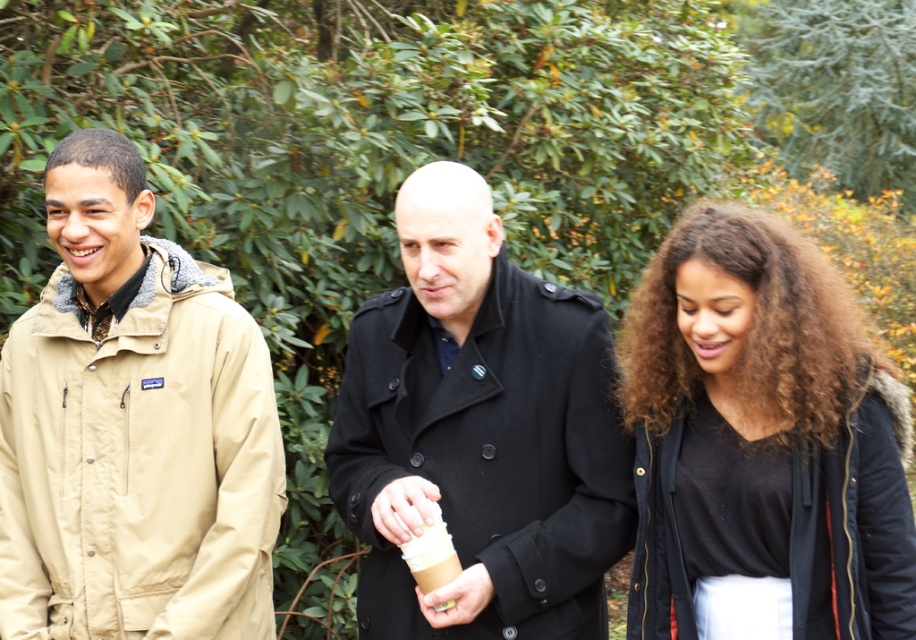
Which of these two, black matte coat at center or brown paper cup at center, stands shorter?

brown paper cup at center

Does black matte coat at center have a larger size compared to brown paper cup at center?

Yes.

Find the location of a particular element. Image resolution: width=916 pixels, height=640 pixels. black matte coat at center is located at coordinates click(478, 432).

Image resolution: width=916 pixels, height=640 pixels. In order to click on black matte coat at center in this screenshot , I will do `click(478, 432)`.

Does tan fabric jacket at left appear on the right side of brown paper cup at center?

In fact, tan fabric jacket at left is to the left of brown paper cup at center.

From the picture: Can you confirm if tan fabric jacket at left is shorter than brown paper cup at center?

Incorrect, tan fabric jacket at left's height does not fall short of brown paper cup at center's.

Is point (240, 371) positioned behind point (435, 608)?

Yes, point (240, 371) is behind point (435, 608).

At what (x,y) coordinates should I click in order to perform the action: click on tan fabric jacket at left. Please return your answer as a coordinate pair (x, y). Looking at the image, I should click on (132, 428).

Can you confirm if tan fabric jacket at left is thinner than black matte jacket at right?

No.

The width and height of the screenshot is (916, 640). I want to click on tan fabric jacket at left, so [132, 428].

Find the location of `tan fabric jacket at left`. tan fabric jacket at left is located at coordinates (132, 428).